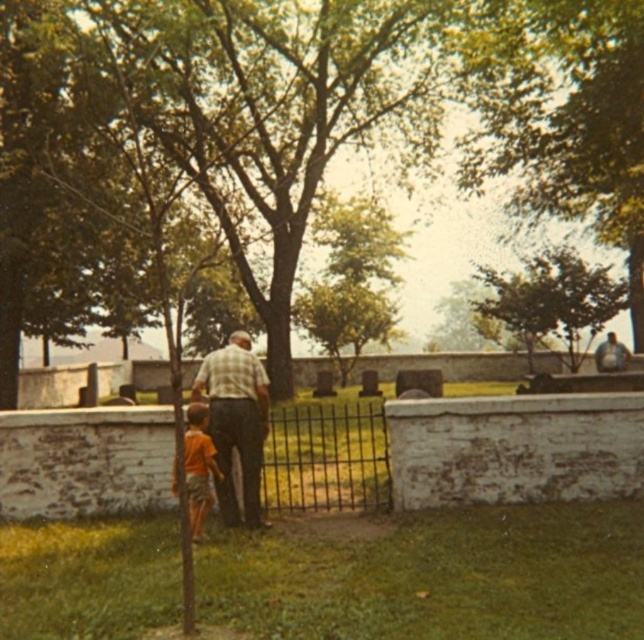
You are standing in the cemetery and notice two clothing items in the scene. The plaid fabric at center is part of an adult wearing a plaid shirt, and the matte gray shirt at upper right belongs to a child. Which clothing item is closer to you?

The plaid fabric at center is closer to you because it is positioned over the matte gray shirt at upper right.

You are standing in the cemetery scene and want to place a small flower at the closest point between point (238, 419) and point (612, 356). Which point should you choose?

Point (238, 419) is closer to the camera than point (612, 356), so you should place the flower at point (238, 419).

You are a photographer trying to capture both the plaid fabric at center and the orange cotton shirt at lower left in the same frame. Given their sizes, which object would you need to move closer to the camera to ensure both fit within the frame?

The plaid fabric at center is narrower than the orange cotton shirt at lower left. To ensure both fit within the frame, you should move the plaid fabric at center closer to the camera since it is smaller and requires less space. Alternatively, adjust the camera angle to accommodate both sizes.